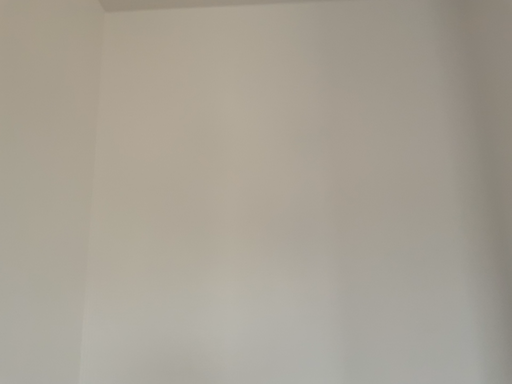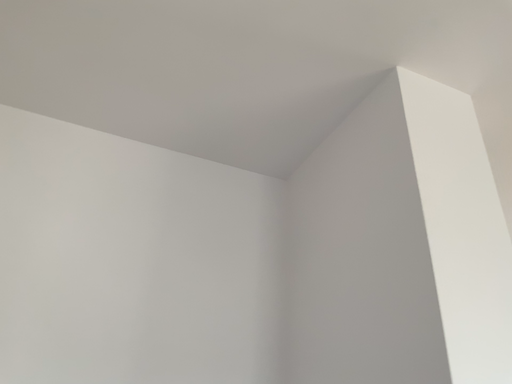
Question: Which way did the camera rotate in the video?

Choices:
 (A) rotated right
 (B) rotated left

Answer: (A)